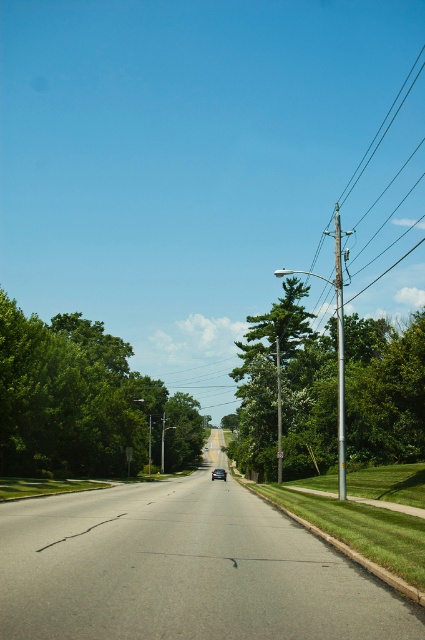
Question: Does green leafy tree at left have a larger size compared to shiny black sedan at center?

Choices:
 (A) no
 (B) yes

Answer: (B)

Question: Does green leafy tree at right have a smaller size compared to shiny black sedan at center?

Choices:
 (A) no
 (B) yes

Answer: (A)

Question: Is green leafy tree at center-right further to the viewer compared to shiny black sedan at center?

Choices:
 (A) yes
 (B) no

Answer: (B)

Question: Which object is positioned farthest from the green leafy tree at left?

Choices:
 (A) shiny black sedan at center
 (B) green leafy tree at center-right

Answer: (A)

Question: Estimate the real-world distances between objects in this image. Which object is closer to the green leafy tree at left?

Choices:
 (A) shiny black sedan at center
 (B) green leafy tree at center-right

Answer: (B)

Question: Which point appears closest to the camera in this image?

Choices:
 (A) (99, 326)
 (B) (295, 307)

Answer: (A)